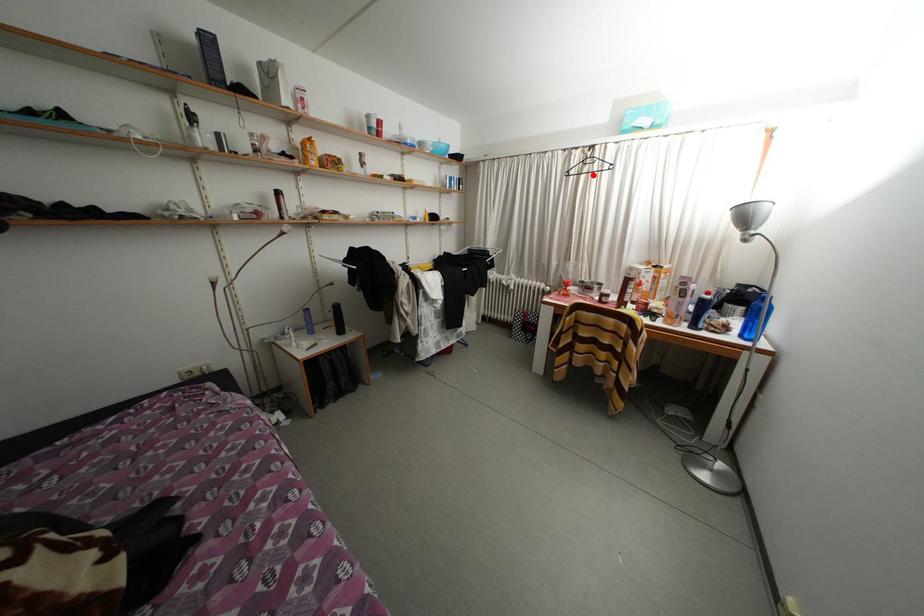
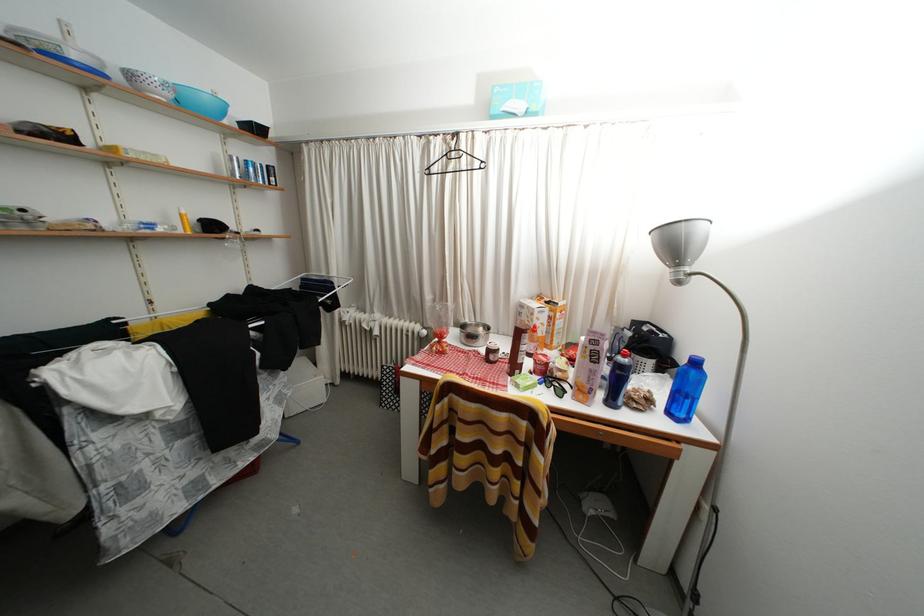
Question: I am providing you with two images of the same scene from different viewpoints. A red point is marked on the first image. At the location where the point appears in image 1, is it still visible in image 2?

Choices:
 (A) Yes
 (B) No

Answer: (A)